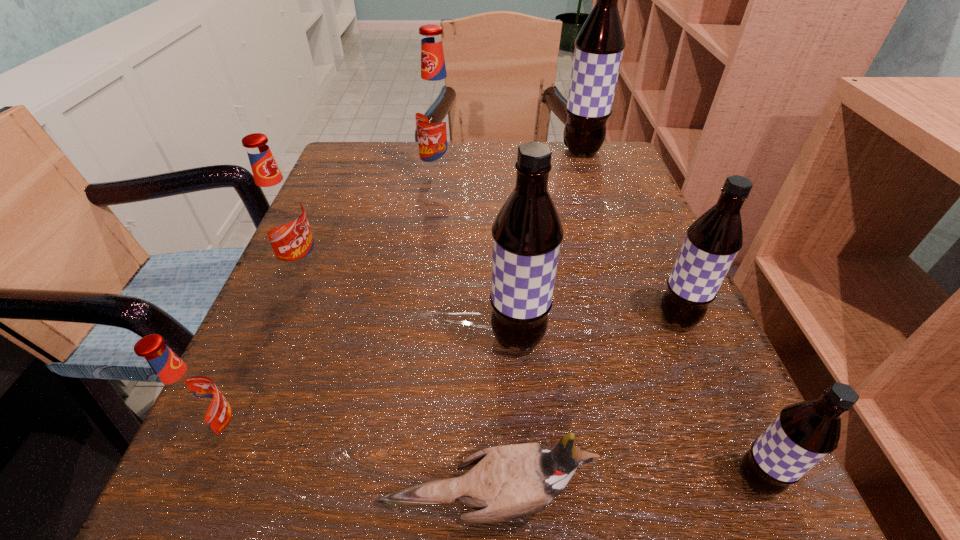
At what (x,y) coordinates should I click in order to perform the action: click on the third closest red root beer relative to the bird. Please return your answer as a coordinate pair (x, y). Looking at the image, I should click on pos(436,114).

Locate an element on the screen. The height and width of the screenshot is (540, 960). free space that satisfies the following two spatial constraints: 1. on the back side of the second smallest red root beer; 2. on the left side of the farthest root beer is located at coordinates (352, 151).

Locate an element on the screen. The width and height of the screenshot is (960, 540). blank area in the image that satisfies the following two spatial constraints: 1. on the front side of the rightmost red root beer; 2. on the right side of the smallest brown root beer is located at coordinates (405, 480).